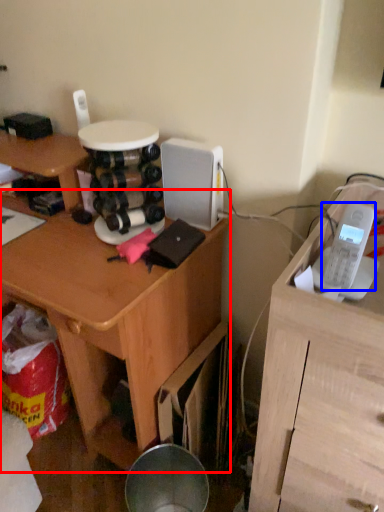
Question: Which object appears farthest to the camera in this image, desk (highlighted by a red box) or ipod (highlighted by a blue box)?

Choices:
 (A) desk
 (B) ipod

Answer: (A)